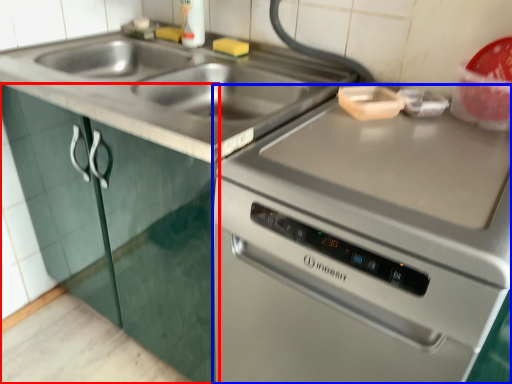
Question: Which of the following is the closest to the observer, cabinetry (highlighted by a red box) or oven (highlighted by a blue box)?

Choices:
 (A) cabinetry
 (B) oven

Answer: (B)